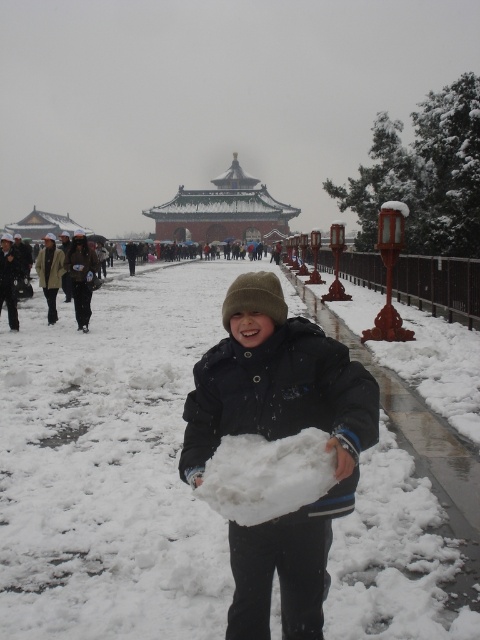
Question: Which point is farther to the camera?

Choices:
 (A) white fluffy snow at center
 (B) white fluffy snowball at center

Answer: (A)

Question: Does white fluffy snow at center appear over white fluffy snowball at center?

Choices:
 (A) no
 (B) yes

Answer: (A)

Question: Which of the following is the closest to the observer?

Choices:
 (A) (290, 566)
 (B) (16, 564)

Answer: (A)

Question: Is white fluffy snow at center to the left of white fluffy snowball at center from the viewer's perspective?

Choices:
 (A) no
 (B) yes

Answer: (B)

Question: Is white fluffy snow at center bigger than white fluffy snowball at center?

Choices:
 (A) yes
 (B) no

Answer: (A)